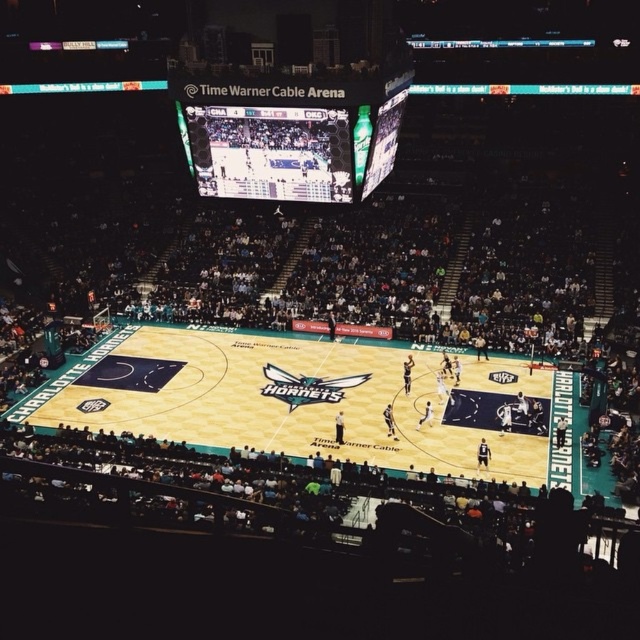
Question: Which point appears farthest from the camera in this image?

Choices:
 (A) (308, 83)
 (B) (305, 429)

Answer: (B)

Question: Where is teal glossy basketball court at center located in relation to matte black scoreboard at upper center in the image?

Choices:
 (A) below
 (B) above

Answer: (A)

Question: Does teal glossy basketball court at center lie behind matte black scoreboard at upper center?

Choices:
 (A) no
 (B) yes

Answer: (B)

Question: Is teal glossy basketball court at center to the right of matte black scoreboard at upper center from the viewer's perspective?

Choices:
 (A) no
 (B) yes

Answer: (A)